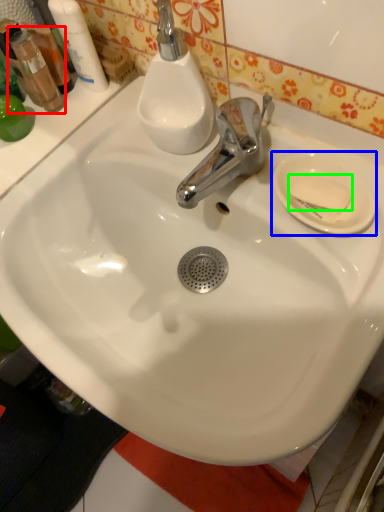
Question: Which object is positioned closest to mouthwash (highlighted by a red box)? Select from plate (highlighted by a blue box) and soap (highlighted by a green box).

Choices:
 (A) plate
 (B) soap

Answer: (A)